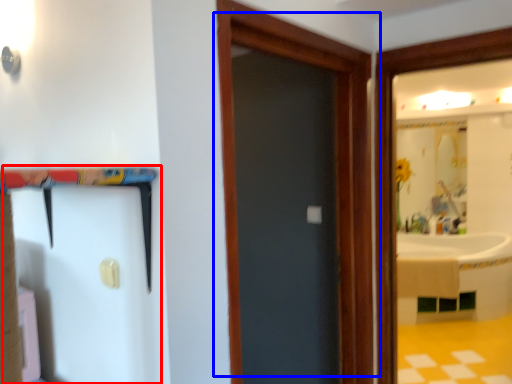
Question: Among these objects, which one is nearest to the camera, barn door (highlighted by a red box) or door (highlighted by a blue box)?

Choices:
 (A) barn door
 (B) door

Answer: (A)